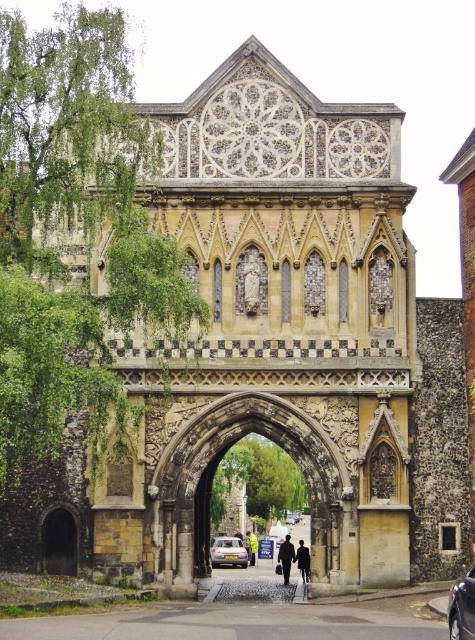
Question: Does dark brown stone archway at lower left come in front of black fabric person at center?

Choices:
 (A) no
 (B) yes

Answer: (B)

Question: Which point is closer to the camera taking this photo?

Choices:
 (A) (279, 561)
 (B) (454, 611)

Answer: (B)

Question: Can you confirm if dark blue jeans at center is bigger than black fabric person at center?

Choices:
 (A) no
 (B) yes

Answer: (B)

Question: Does dark brown stone archway at lower left appear on the right side of dark blue fabric coat at center?

Choices:
 (A) yes
 (B) no

Answer: (B)

Question: Which object is closer to the camera taking this photo?

Choices:
 (A) metallic silver car at center
 (B) stone textured archway at center
 (C) dark brown stone archway at lower left

Answer: (A)

Question: Which point appears closest to the camera in this image?

Choices:
 (A) (247, 552)
 (B) (300, 547)
 (C) (448, 628)
 (D) (287, 579)

Answer: (C)